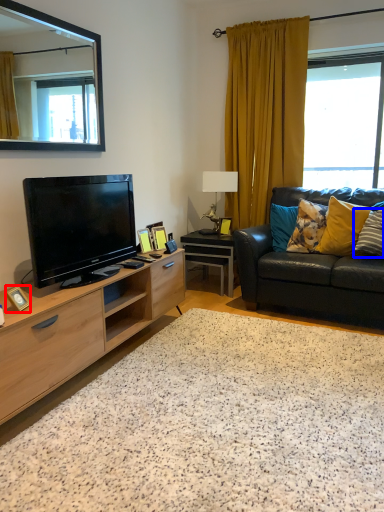
Question: Which of the following is the farthest to the observer, picture frame (highlighted by a red box) or pillow (highlighted by a blue box)?

Choices:
 (A) picture frame
 (B) pillow

Answer: (B)